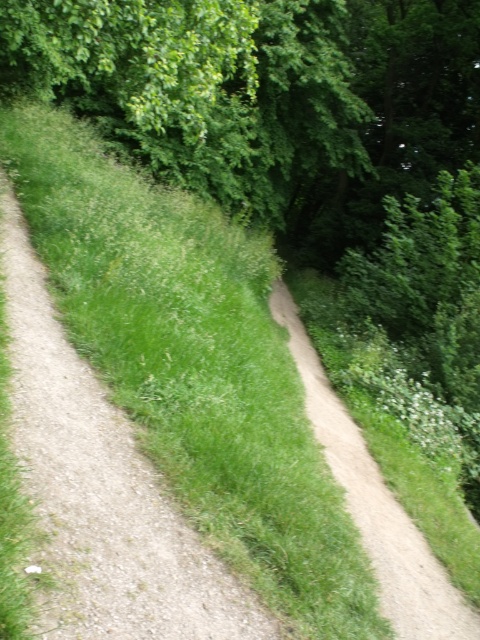
Question: Among these objects, which one is farthest from the camera?

Choices:
 (A) green grassy trail at center
 (B) green leafy tree at upper center

Answer: (B)

Question: Is green leafy tree at upper center to the left of green grassy trail at center from the viewer's perspective?

Choices:
 (A) yes
 (B) no

Answer: (B)

Question: Does green leafy tree at upper center have a larger size compared to green grassy trail at center?

Choices:
 (A) yes
 (B) no

Answer: (A)

Question: Which of the following is the closest to the observer?

Choices:
 (A) green grassy trail at center
 (B) green leafy tree at upper center

Answer: (A)

Question: Does green leafy tree at upper center appear on the left side of green grassy trail at center?

Choices:
 (A) no
 (B) yes

Answer: (A)